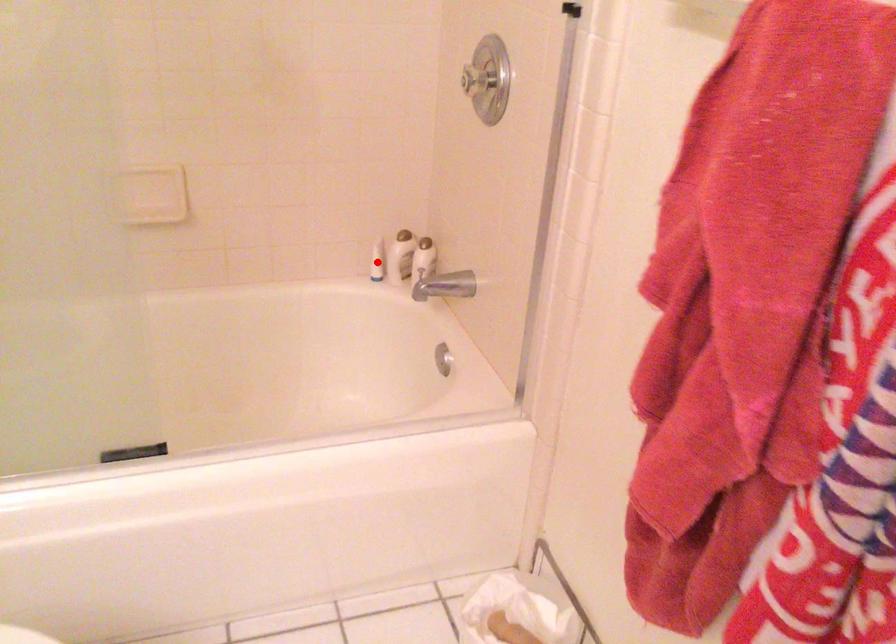
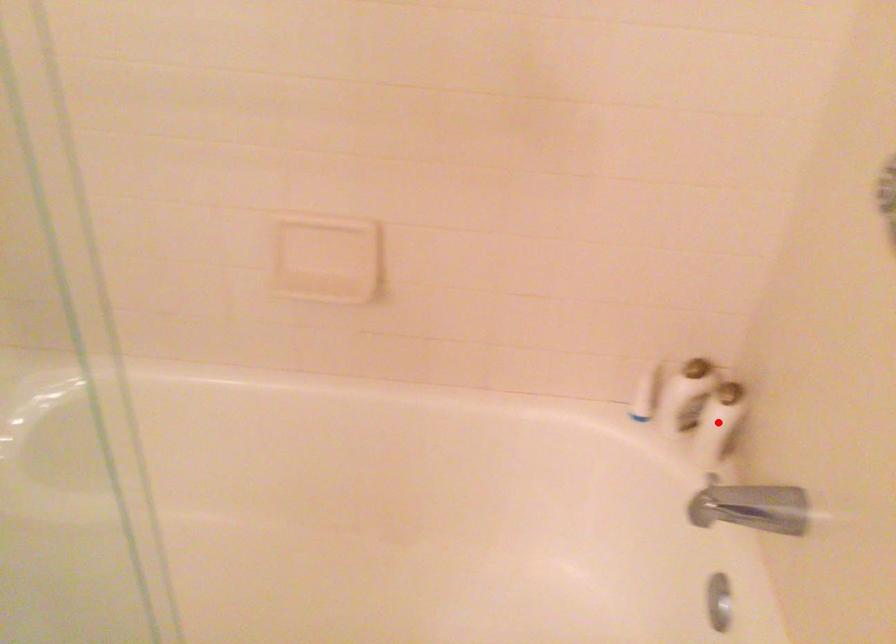
I am providing you with two images of the same scene from different viewpoints. A red point is marked on the first image and another point is marked on the second image. Are the points marked in image1 and image2 representing the same 3D position?

No